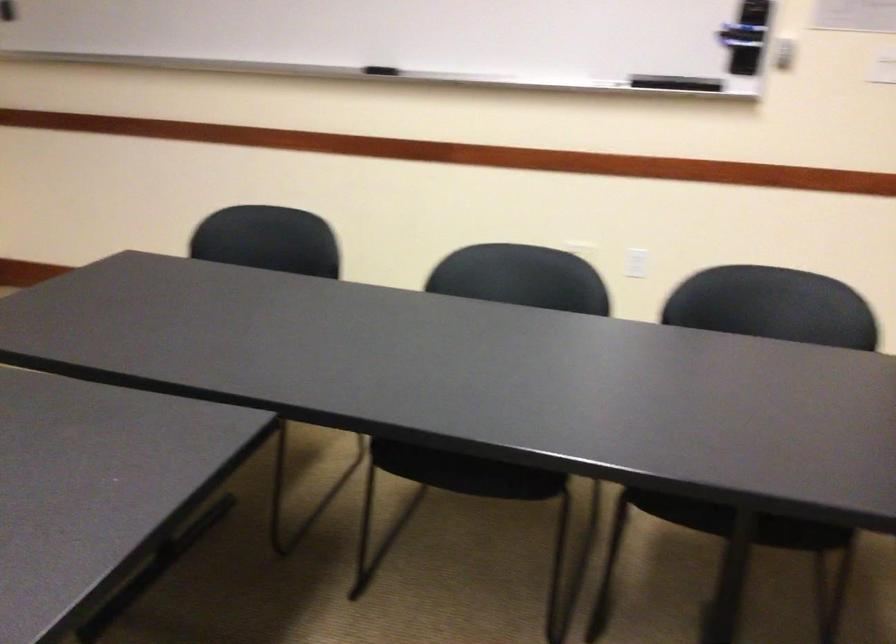
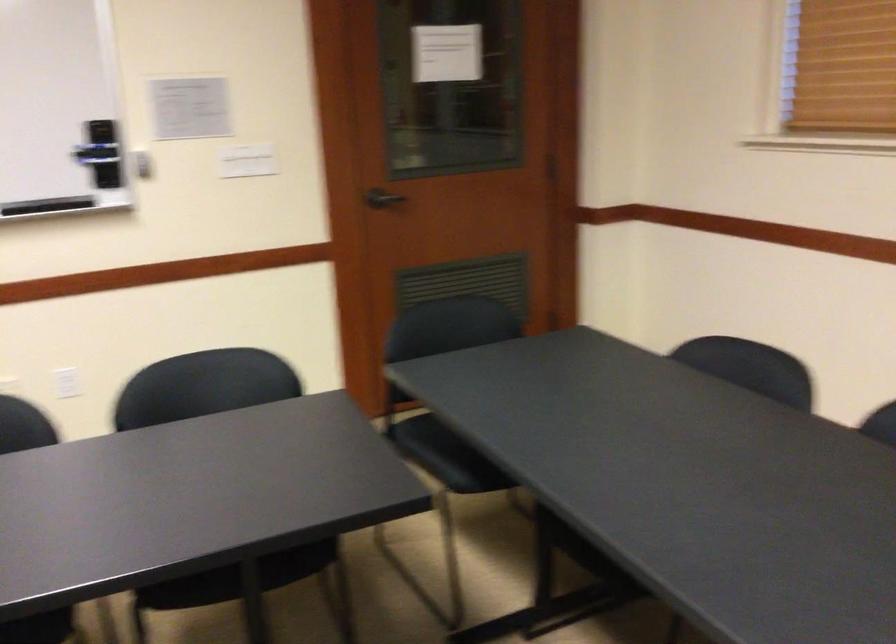
In the second image, find the point that corresponds to the point at 644,270 in the first image.

(66, 383)